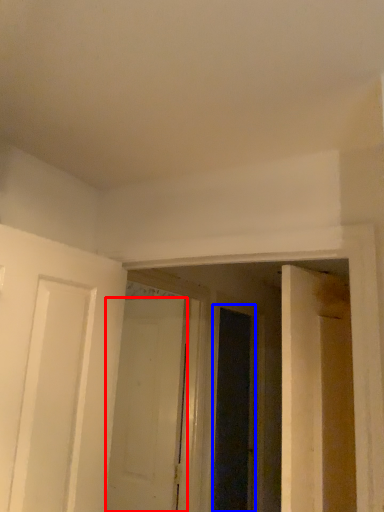
Question: Which point is further to the camera, door (highlighted by a red box) or screen door (highlighted by a blue box)?

Choices:
 (A) door
 (B) screen door

Answer: (B)